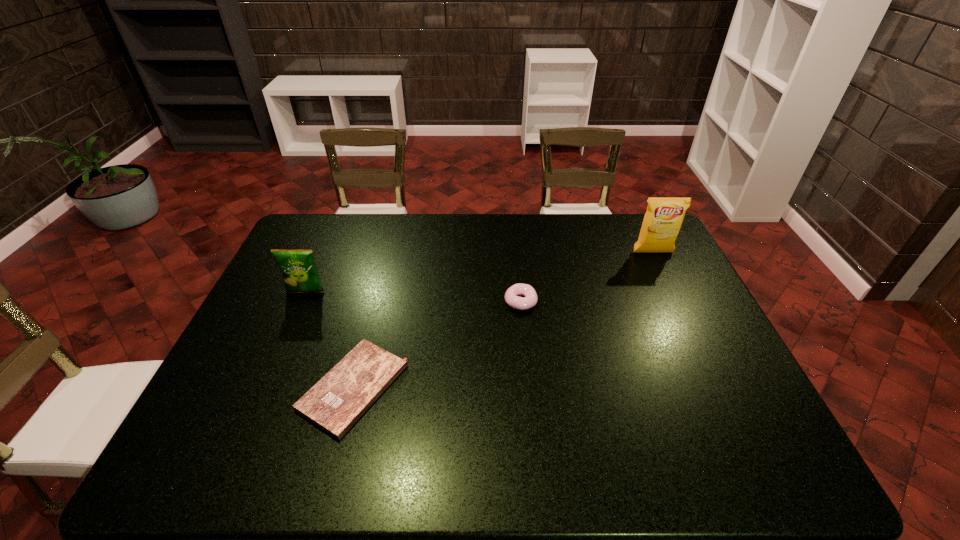
Identify the location of free location at the right edge. (774, 432).

Locate an element on the screen. The height and width of the screenshot is (540, 960). vacant region at the far left corner of the desktop is located at coordinates point(330,246).

At what (x,y) coordinates should I click in order to perform the action: click on vacant area at the near left corner. Please return your answer as a coordinate pair (x, y). Image resolution: width=960 pixels, height=540 pixels. Looking at the image, I should click on (204, 473).

Locate an element on the screen. Image resolution: width=960 pixels, height=540 pixels. vacant space at the far right corner is located at coordinates [x=633, y=219].

At what (x,y) coordinates should I click in order to perform the action: click on unoccupied position between the taller crisp (potato chip) and the doughnut. Please return your answer as a coordinate pair (x, y). The image size is (960, 540). Looking at the image, I should click on (587, 277).

In order to click on blank region between the leftmost object and the tallest object in this screenshot , I will do `click(479, 272)`.

You are a GUI agent. You are given a task and a screenshot of the screen. Output one action in this format:
    pyautogui.click(x=<x>, y=<y>)
    Task: Click on the blank region between the third object from left to right and the third object from right to left
    
    Given the screenshot: What is the action you would take?
    pyautogui.click(x=437, y=345)

Identify the location of blank region between the second object from left to right and the second tallest object. The height and width of the screenshot is (540, 960). (329, 340).

This screenshot has width=960, height=540. What are the coordinates of `vacant region between the second object from right to left and the left crisp (potato chip)` in the screenshot? It's located at (414, 297).

Locate an element on the screen. empty space that is in between the shortest object and the farthest object is located at coordinates (503, 320).